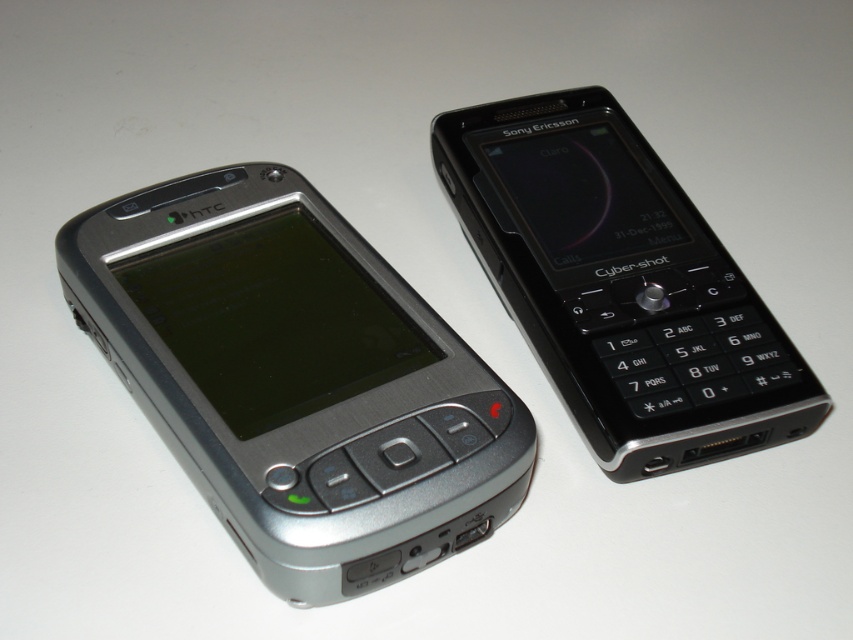
Question: Which object is farther from the camera taking this photo?

Choices:
 (A) black glossy sony ericsson cyber-shot at right
 (B) silver metallic smartphone at left

Answer: (A)

Question: In this image, where is silver metallic smartphone at left located relative to black glossy sony ericsson cyber-shot at right?

Choices:
 (A) below
 (B) above

Answer: (A)

Question: Does silver metallic smartphone at left have a greater width compared to black glossy sony ericsson cyber-shot at right?

Choices:
 (A) yes
 (B) no

Answer: (A)

Question: Does silver metallic smartphone at left have a smaller size compared to black glossy sony ericsson cyber-shot at right?

Choices:
 (A) no
 (B) yes

Answer: (A)

Question: Which object appears farthest from the camera in this image?

Choices:
 (A) silver metallic smartphone at left
 (B) black glossy sony ericsson cyber-shot at right

Answer: (B)